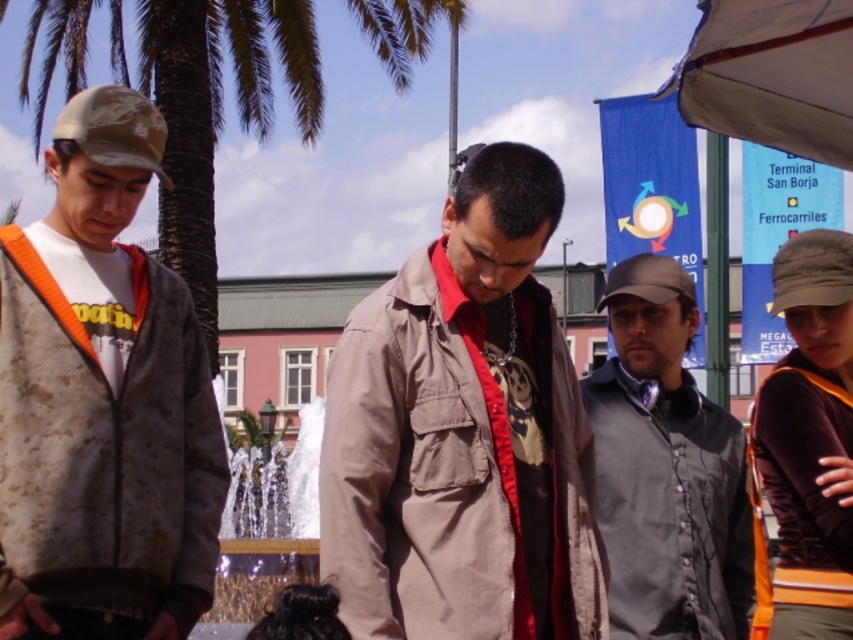
Question: Which object appears farthest from the camera in this image?

Choices:
 (A) matte brown baseball cap at center
 (B) black fabric baseball cap at upper right
 (C) camouflage jacket at left
 (D) metallic reflective water at center

Answer: (D)

Question: Can you confirm if brown matte trench coat at right is bigger than matte brown baseball cap at center?

Choices:
 (A) no
 (B) yes

Answer: (A)

Question: Does gray matte vest at center appear on the right side of brown matte trench coat at right?

Choices:
 (A) no
 (B) yes

Answer: (A)

Question: Estimate the real-world distances between objects in this image. Which object is farther from the matte khaki jacket at center?

Choices:
 (A) camouflage fabric baseball cap at left
 (B) black fabric baseball cap at upper right
 (C) camouflage jacket at left
 (D) matte brown baseball cap at center

Answer: (B)

Question: Can you confirm if green leafy palm tree at upper left is wider than brown matte trench coat at right?

Choices:
 (A) no
 (B) yes

Answer: (B)

Question: Which point is closer to the camera?

Choices:
 (A) (248, 451)
 (B) (125, 129)

Answer: (B)